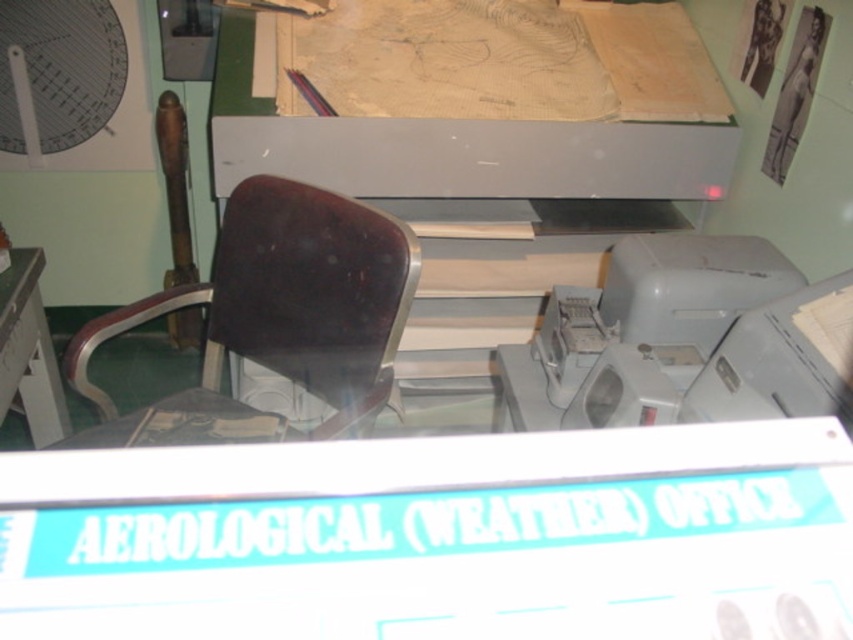
Is matte white mechanical fan at upper left to the left of white plastic table at left from the viewer's perspective?

Indeed, matte white mechanical fan at upper left is positioned on the left side of white plastic table at left.

Between matte white mechanical fan at upper left and white plastic table at left, which one is positioned higher?

matte white mechanical fan at upper left is higher up.

Does point (80, 99) come in front of point (24, 348)?

No.

This screenshot has width=853, height=640. Identify the location of matte white mechanical fan at upper left. point(57,74).

Which is in front, point (355, 410) or point (96, 112)?

Positioned in front is point (355, 410).

Does brown leather chair at left have a lesser height compared to matte white mechanical fan at upper left?

No.

Identify the location of brown leather chair at left. The height and width of the screenshot is (640, 853). (274, 317).

Between point (125, 424) and point (22, 298), which one is positioned behind?

Point (22, 298)

Is brown leather chair at left to the right of white plastic table at left from the viewer's perspective?

Correct, you'll find brown leather chair at left to the right of white plastic table at left.

The height and width of the screenshot is (640, 853). I want to click on brown leather chair at left, so click(274, 317).